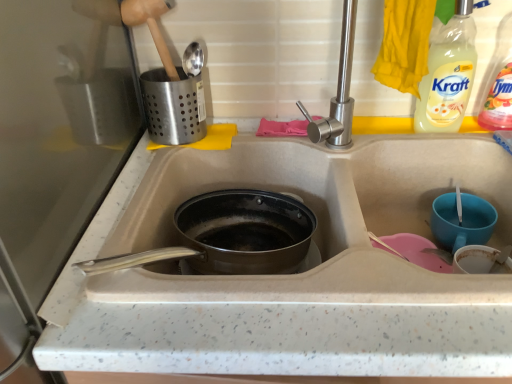
You are a GUI agent. You are given a task and a screenshot of the screen. Output one action in this format:
    pyautogui.click(x=<x>, y=<y>)
    Task: Click on the matte gray sink at center
    This screenshot has height=384, width=512.
    Given the screenshot: What is the action you would take?
    pyautogui.click(x=319, y=218)

This screenshot has width=512, height=384. In order to click on clear plastic bottle at upper right, the first bottle positioned from the right in this screenshot , I will do `click(498, 83)`.

This screenshot has height=384, width=512. What are the coordinates of `blue glossy cup at right` in the screenshot? It's located at (462, 221).

Describe the element at coordinates (462, 221) in the screenshot. I see `blue glossy cup at right` at that location.

Describe the element at coordinates (151, 26) in the screenshot. Image resolution: width=512 pixels, height=384 pixels. I see `wooden shovel at upper left` at that location.

Where is `anodized aluminum frying pan at center`? anodized aluminum frying pan at center is located at coordinates (230, 235).

From a real-world perspective, is blue glossy cup at right on top of clear plastic bottle at upper right, the first bottle positioned from the right?

Actually, blue glossy cup at right is physically below clear plastic bottle at upper right, the first bottle positioned from the right, in the real world.

Is blue glossy cup at right closer to camera compared to clear plastic bottle at upper right, the 2th bottle positioned from the left?

No, blue glossy cup at right is behind clear plastic bottle at upper right, the 2th bottle positioned from the left.

Is blue glossy cup at right wider or thinner than clear plastic bottle at upper right, the 2th bottle positioned from the left?

In the image, blue glossy cup at right appears to be wider than clear plastic bottle at upper right, the 2th bottle positioned from the left.

Is point (456, 2) behind point (459, 226)?

No, it is in front of (459, 226).

Considering the relative sizes of clear plastic bottle at upper right, acting as the second bottle starting from the right, and blue glossy cup at right in the image provided, is clear plastic bottle at upper right, acting as the second bottle starting from the right, shorter than blue glossy cup at right?

No, clear plastic bottle at upper right, acting as the second bottle starting from the right, is not shorter than blue glossy cup at right.

Relative to blue glossy cup at right, is clear plastic bottle at upper right, acting as the second bottle starting from the right, in front or behind?

Visually, clear plastic bottle at upper right, acting as the second bottle starting from the right, is located in front of blue glossy cup at right.

How far apart are clear plastic bottle at upper right, the 1th bottle positioned from the left, and blue glossy cup at right?

8.76 inches.

How far apart are anodized aluminum frying pan at center and matte gray sink at center?

They are 4.06 inches apart.

Considering the relative positions of anodized aluminum frying pan at center and matte gray sink at center in the image provided, is anodized aluminum frying pan at center to the left of matte gray sink at center from the viewer's perspective?

Yes.

Based on the photo, is anodized aluminum frying pan at center outside of matte gray sink at center?

No, anodized aluminum frying pan at center is not entirely external to matte gray sink at center.

Considering the sizes of objects anodized aluminum frying pan at center and matte gray sink at center in the image provided, who is wider, anodized aluminum frying pan at center or matte gray sink at center?

matte gray sink at center.

Between blue glossy cup at right and anodized aluminum frying pan at center, which one has larger width?

anodized aluminum frying pan at center is wider.

Is blue glossy cup at right positioned in front of anodized aluminum frying pan at center?

No, it is behind anodized aluminum frying pan at center.

Considering the relative sizes of blue glossy cup at right and anodized aluminum frying pan at center in the image provided, is blue glossy cup at right smaller than anodized aluminum frying pan at center?

Indeed, blue glossy cup at right has a smaller size compared to anodized aluminum frying pan at center.

From a real-world perspective, does blue glossy cup at right stand above anodized aluminum frying pan at center?

Yes, from a real-world perspective, blue glossy cup at right is on top of anodized aluminum frying pan at center.

Is clear plastic bottle at upper right, acting as the second bottle starting from the right, located outside wooden shovel at upper left?

clear plastic bottle at upper right, acting as the second bottle starting from the right, lies outside wooden shovel at upper left's area.

From the image's perspective, is clear plastic bottle at upper right, acting as the second bottle starting from the right, below wooden shovel at upper left?

Yes, from the image's perspective, clear plastic bottle at upper right, acting as the second bottle starting from the right, is below wooden shovel at upper left.

From a real-world perspective, is clear plastic bottle at upper right, the 1th bottle positioned from the left, positioned over wooden shovel at upper left based on gravity?

No, from a real-world perspective, clear plastic bottle at upper right, the 1th bottle positioned from the left, is not above wooden shovel at upper left.

Looking at this image, is clear plastic bottle at upper right, the 1th bottle positioned from the left, touching wooden shovel at upper left?

No, clear plastic bottle at upper right, the 1th bottle positioned from the left, is not next to wooden shovel at upper left.

From the picture: Is the depth of blue glossy cup at right greater than that of wooden shovel at upper left?

No, the depth of blue glossy cup at right is less than that of wooden shovel at upper left.

Could you tell me if blue glossy cup at right is facing wooden shovel at upper left?

No, blue glossy cup at right does not turn towards wooden shovel at upper left.

From a real-world perspective, is blue glossy cup at right physically below wooden shovel at upper left?

Correct, in the physical world, blue glossy cup at right is lower than wooden shovel at upper left.

Is the depth of anodized aluminum frying pan at center less than that of blue glossy cup at right?

Yes, anodized aluminum frying pan at center is closer to the camera.

Is point (121, 266) closer or farther from the camera than point (483, 234)?

Point (121, 266) is positioned closer to the camera compared to point (483, 234).

From a real-world perspective, is anodized aluminum frying pan at center beneath blue glossy cup at right?

Yes.

Is anodized aluminum frying pan at center oriented towards blue glossy cup at right?

No, anodized aluminum frying pan at center does not turn towards blue glossy cup at right.

The width and height of the screenshot is (512, 384). I want to click on basin that is under the clear plastic bottle at upper right, the 2th bottle positioned from the left (from a real-world perspective), so click(x=462, y=221).

Locate an element on the screen. This screenshot has width=512, height=384. basin that is behind the clear plastic bottle at upper right, the 1th bottle positioned from the left is located at coordinates (462, 221).

When comparing their distances from blue glossy cup at right, does matte gray sink at center or clear plastic bottle at upper right, the first bottle positioned from the right, seem closer?

clear plastic bottle at upper right, the first bottle positioned from the right, lies closer to blue glossy cup at right than the other object.

Looking at the image, which one is located closer to matte gray sink at center, blue glossy cup at right or clear plastic bottle at upper right, the first bottle positioned from the right?

blue glossy cup at right lies closer to matte gray sink at center than the other object.

Based on their spatial positions, is clear plastic bottle at upper right, the 2th bottle positioned from the left, or blue glossy cup at right further from matte gray sink at center?

clear plastic bottle at upper right, the 2th bottle positioned from the left, is positioned further to the anchor matte gray sink at center.

In the scene shown: Estimate the real-world distances between objects in this image. Which object is closer to matte gray sink at center, clear plastic bottle at upper right, the 2th bottle positioned from the left, or clear plastic bottle at upper right, the 1th bottle positioned from the left?

clear plastic bottle at upper right, the 1th bottle positioned from the left, is closer to matte gray sink at center.

Considering their positions, is clear plastic bottle at upper right, the 1th bottle positioned from the left, positioned further to clear plastic bottle at upper right, the 2th bottle positioned from the left, than wooden shovel at upper left?

wooden shovel at upper left lies further to clear plastic bottle at upper right, the 2th bottle positioned from the left, than the other object.

Which object lies further to the anchor point matte gray sink at center, anodized aluminum frying pan at center or blue glossy cup at right?

Among the two, blue glossy cup at right is located further to matte gray sink at center.

From the image, which object appears to be nearer to wooden shovel at upper left, anodized aluminum frying pan at center or clear plastic bottle at upper right, the 2th bottle positioned from the left?

anodized aluminum frying pan at center is closer to wooden shovel at upper left.

From the image, which object appears to be farther from clear plastic bottle at upper right, the 2th bottle positioned from the left, wooden shovel at upper left or anodized aluminum frying pan at center?

Based on the image, wooden shovel at upper left appears to be further to clear plastic bottle at upper right, the 2th bottle positioned from the left.

You are a GUI agent. You are given a task and a screenshot of the screen. Output one action in this format:
    pyautogui.click(x=<x>, y=<y>)
    Task: Click on the frying pan between wooden shovel at upper left and blue glossy cup at right in the horizontal direction
    The image size is (512, 384).
    Given the screenshot: What is the action you would take?
    pyautogui.click(x=230, y=235)

Identify the location of bottle that lies between clear plastic bottle at upper right, the first bottle positioned from the right, and matte gray sink at center from top to bottom. This screenshot has width=512, height=384. (448, 74).

Locate an element on the screen. The height and width of the screenshot is (384, 512). bottle that lies between clear plastic bottle at upper right, the 2th bottle positioned from the left, and blue glossy cup at right from top to bottom is located at coordinates (448, 74).

You are a GUI agent. You are given a task and a screenshot of the screen. Output one action in this format:
    pyautogui.click(x=<x>, y=<y>)
    Task: Click on the bottle situated between wooden shovel at upper left and blue glossy cup at right from left to right
    
    Given the screenshot: What is the action you would take?
    pyautogui.click(x=448, y=74)